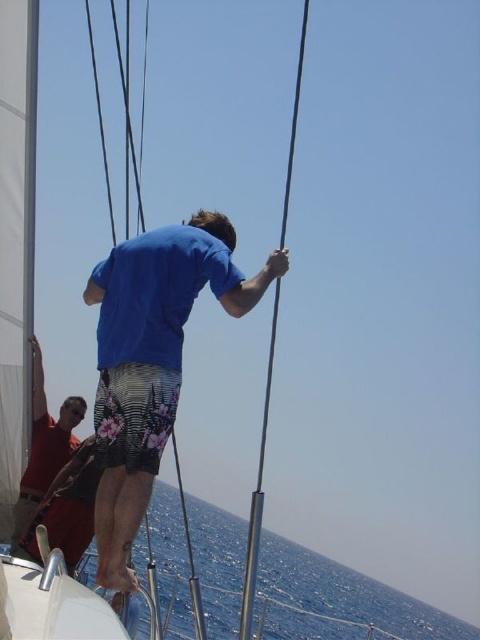
Question: Which object is farther from the camera taking this photo?

Choices:
 (A) blue water at lower left
 (B) matte red shirt at lower left
 (C) blue fabric shirt at center

Answer: (A)

Question: Is blue fabric shirt at center to the left of polished metal mast at center from the viewer's perspective?

Choices:
 (A) yes
 (B) no

Answer: (A)

Question: Does blue fabric shirt at center appear on the left side of blue water at lower left?

Choices:
 (A) yes
 (B) no

Answer: (A)

Question: Which object is the farthest from the polished metal mast at center?

Choices:
 (A) blue water at lower left
 (B) blue fabric shirt at center
 (C) matte red shirt at lower left

Answer: (A)

Question: Is blue fabric shirt at center behind polished metal mast at center?

Choices:
 (A) yes
 (B) no

Answer: (A)

Question: Among these objects, which one is nearest to the camera?

Choices:
 (A) blue water at lower left
 (B) matte red shirt at lower left
 (C) polished metal mast at center

Answer: (C)